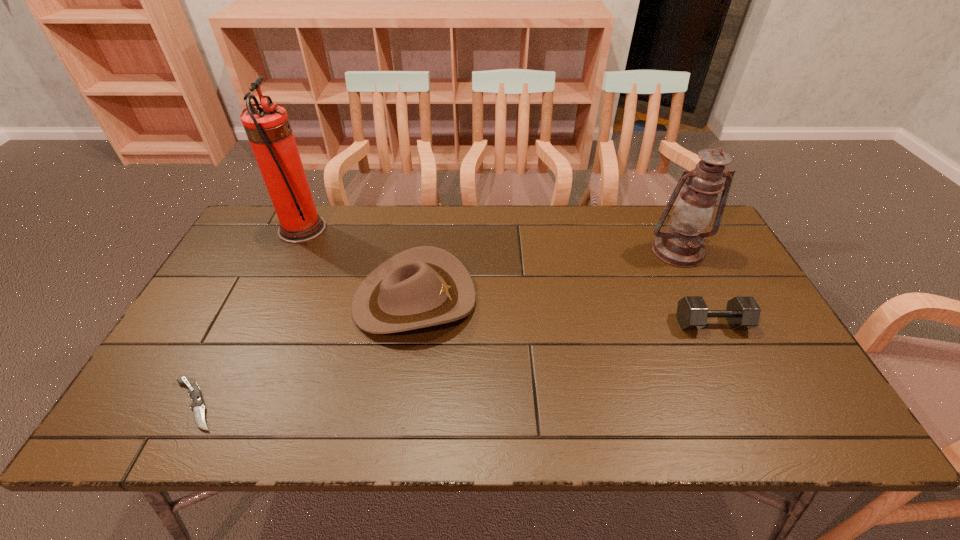
Find the location of `blank space located on the left of the dumbbell`. blank space located on the left of the dumbbell is located at coordinates coord(644,323).

Find the location of a particular element. The width and height of the screenshot is (960, 540). vacant space located 0.390m on the right of the shortest object is located at coordinates (397, 404).

I want to click on fire extinguisher that is at the far edge, so click(x=267, y=126).

Where is `oil lamp located at the far edge`? oil lamp located at the far edge is located at coordinates (681, 245).

Identify the location of object at the near edge. (197, 405).

Where is `fire extinguisher present at the left edge`? fire extinguisher present at the left edge is located at coordinates (267, 126).

At what (x,y) coordinates should I click in order to perform the action: click on pocketknife at the left edge. Please return your answer as a coordinate pair (x, y). Looking at the image, I should click on (197, 405).

The width and height of the screenshot is (960, 540). What are the coordinates of `oil lamp positioned at the right edge` in the screenshot? It's located at (681, 245).

The width and height of the screenshot is (960, 540). Find the location of `dumbbell present at the right edge`. dumbbell present at the right edge is located at coordinates (742, 312).

Identify the location of object present at the far left corner. The image size is (960, 540). (267, 126).